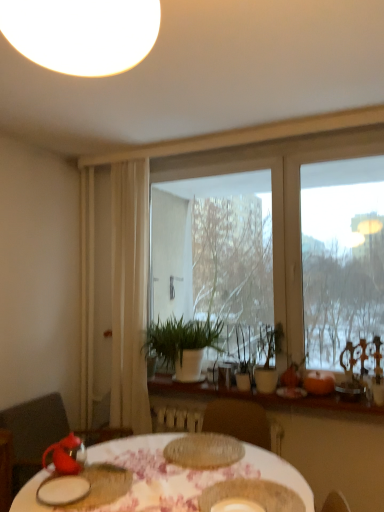
Question: Is white sheer curtain at left at the right side of orange matte pumpkin at right, arranged as the 2th tableware when viewed from the right?

Choices:
 (A) no
 (B) yes

Answer: (A)

Question: Is white sheer curtain at left oriented towards orange matte pumpkin at right, arranged as the 2th tableware when viewed from the right?

Choices:
 (A) no
 (B) yes

Answer: (A)

Question: Would you say white sheer curtain at left is outside orange matte pumpkin at right, arranged as the 2th tableware when viewed from the right?

Choices:
 (A) yes
 (B) no

Answer: (A)

Question: Considering the relative positions of white sheer curtain at left and orange matte pumpkin at right, the 9th tableware from the left, in the image provided, is white sheer curtain at left in front of orange matte pumpkin at right, the 9th tableware from the left,?

Choices:
 (A) yes
 (B) no

Answer: (B)

Question: From a real-world perspective, does white sheer curtain at left sit lower than orange matte pumpkin at right, arranged as the 2th tableware when viewed from the right?

Choices:
 (A) no
 (B) yes

Answer: (A)

Question: Looking at their shapes, would you say translucent glass plate at center, which is the fourth tableware from left to right, is wider or thinner than orange matte pumpkin at right, arranged as the 2th tableware when viewed from the right?

Choices:
 (A) thin
 (B) wide

Answer: (B)

Question: Is point (188, 460) closer or farther from the camera than point (332, 390)?

Choices:
 (A) closer
 (B) farther

Answer: (A)

Question: In the image, is translucent glass plate at center, the 7th tableware in the right-to-left sequence, on the left side or the right side of orange matte pumpkin at right, arranged as the 2th tableware when viewed from the right?

Choices:
 (A) left
 (B) right

Answer: (A)

Question: From a real-world perspective, relative to orange matte pumpkin at right, arranged as the 2th tableware when viewed from the right, is translucent glass plate at center, which is the fourth tableware from left to right, vertically above or below?

Choices:
 (A) below
 (B) above

Answer: (A)

Question: From the image's perspective, is matte ceramic bowl at center, which is the 7th tableware from left to right, positioned above or below matte brown plate at center, which appears as the 6th tableware when viewed from the right?

Choices:
 (A) below
 (B) above

Answer: (A)

Question: Considering the positions of matte ceramic bowl at center, which is the 7th tableware from left to right, and matte brown plate at center, which appears as the 6th tableware when viewed from the right, in the image, is matte ceramic bowl at center, which is the 7th tableware from left to right, bigger or smaller than matte brown plate at center, which appears as the 6th tableware when viewed from the right,?

Choices:
 (A) big
 (B) small

Answer: (A)

Question: Would you say matte ceramic bowl at center, which is the 7th tableware from left to right, is to the left or to the right of matte brown plate at center, which appears as the 6th tableware when viewed from the right, in the picture?

Choices:
 (A) right
 (B) left

Answer: (A)

Question: Is matte ceramic bowl at center, which appears as the fourth tableware when viewed from the right, in front of or behind matte brown plate at center, the 5th tableware viewed from the left, in the image?

Choices:
 (A) front
 (B) behind

Answer: (A)

Question: Is wooden at center in front of or behind white ceramic plate at lower left, which appears as the 9th tableware when viewed from the right, in the image?

Choices:
 (A) behind
 (B) front

Answer: (A)

Question: Is point (182, 392) closer or farther from the camera than point (59, 487)?

Choices:
 (A) closer
 (B) farther

Answer: (B)